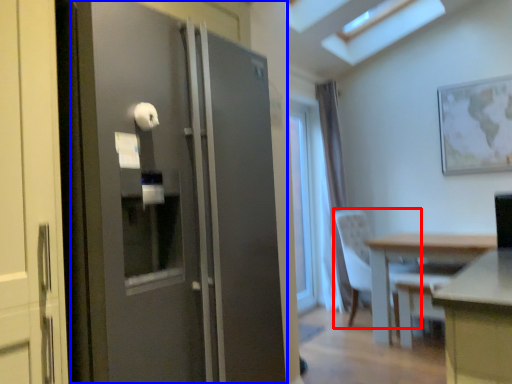
Question: Which object is further to the camera taking this photo, chair (highlighted by a red box) or door (highlighted by a blue box)?

Choices:
 (A) chair
 (B) door

Answer: (A)